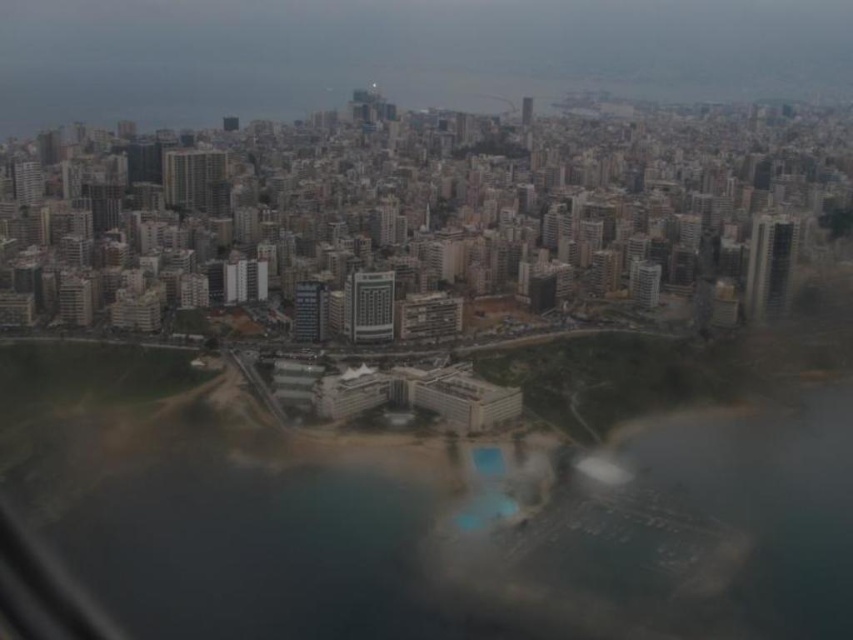
Is point (141, 520) positioned before point (360, 310)?

That is True.

Is the position of clear blue water at center more distant than that of matte glass building at center?

No.

Between point (677, 628) and point (357, 326), which one is positioned behind?

The point (357, 326) is behind.

This screenshot has width=853, height=640. I want to click on clear blue water at center, so click(437, 509).